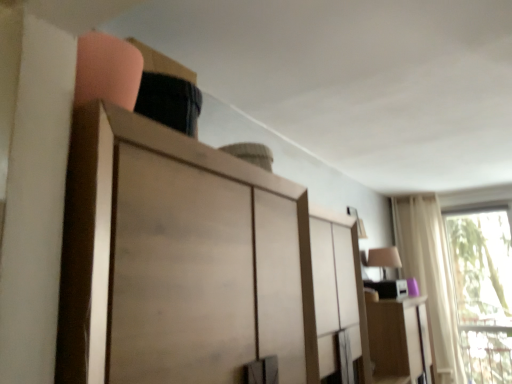
Question: Is point 480,233 closer or farther from the camera than point 74,354?

Choices:
 (A) farther
 (B) closer

Answer: (A)

Question: Considering the positions of transparent glass window at right and wooden cabinet at upper center in the image, is transparent glass window at right wider or thinner than wooden cabinet at upper center?

Choices:
 (A) thin
 (B) wide

Answer: (A)

Question: Which object is the closest to the white sheer curtain at right?

Choices:
 (A) matte wood cabinet at right
 (B) transparent glass window at right
 (C) wooden cabinet at upper center

Answer: (B)

Question: Based on their relative distances, which object is farther from the white sheer curtain at right?

Choices:
 (A) matte wood cabinet at right
 (B) wooden cabinet at upper center
 (C) transparent glass window at right

Answer: (B)